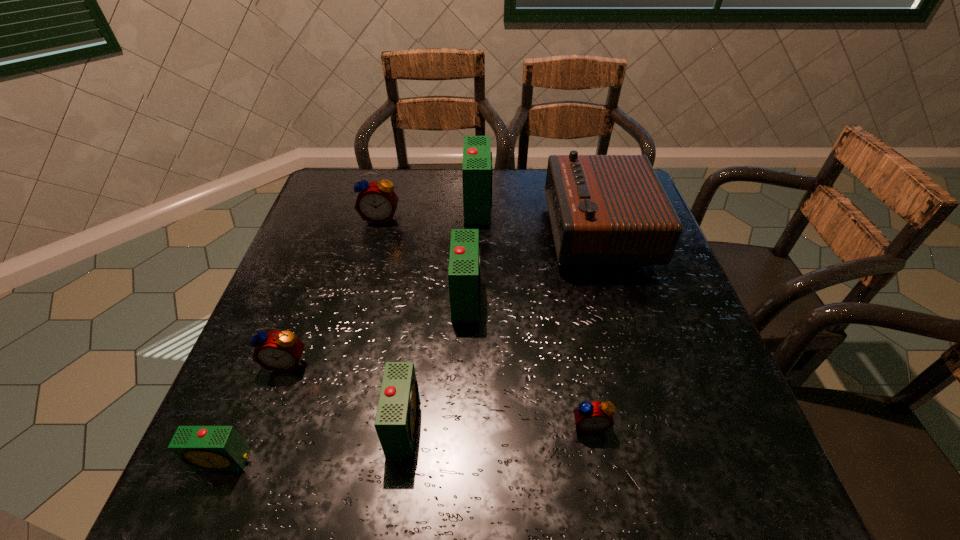
Identify which red alarm clock is the closest to the nearest red alarm clock. Please provide its 2D coordinates. Your answer should be formatted as a tuple, i.e. [(x, y)], where the tuple contains the x and y coordinates of a point satisfying the conditions above.

[(281, 351)]

I want to click on free spot that satisfies the following two spatial constraints: 1. on the front panel of the radio receiver; 2. on the front-facing side of the leftmost red alarm clock, so [x=636, y=362].

You are a GUI agent. You are given a task and a screenshot of the screen. Output one action in this format:
    pyautogui.click(x=<x>, y=<y>)
    Task: Click on the vacant space that satisfies the following two spatial constraints: 1. on the front-facing side of the farthest green alarm clock; 2. on the front-facing side of the fifth farthest object
    
    Given the screenshot: What is the action you would take?
    pyautogui.click(x=477, y=362)

The width and height of the screenshot is (960, 540). In order to click on free point that satisfies the following two spatial constraints: 1. on the front-facing side of the third smallest green alarm clock; 2. on the front-facing side of the leftmost red alarm clock in this screenshot , I will do `click(465, 362)`.